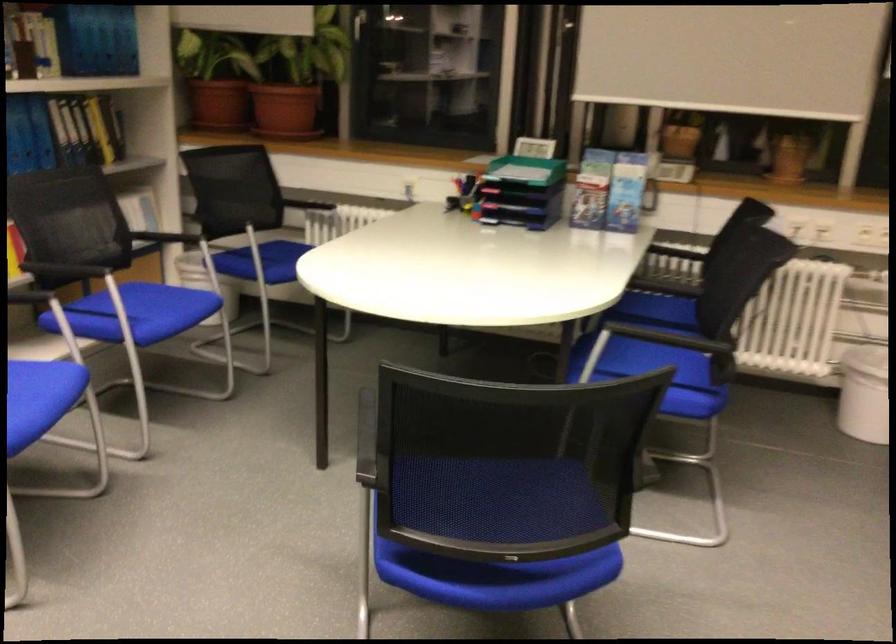
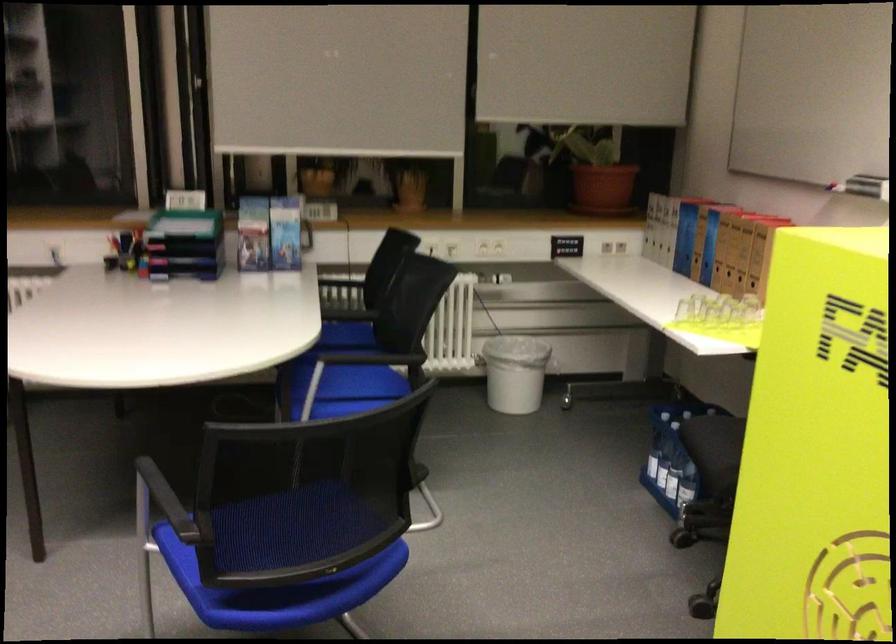
Locate, in the second image, the point that corresponds to point (644, 359) in the first image.

(349, 382)